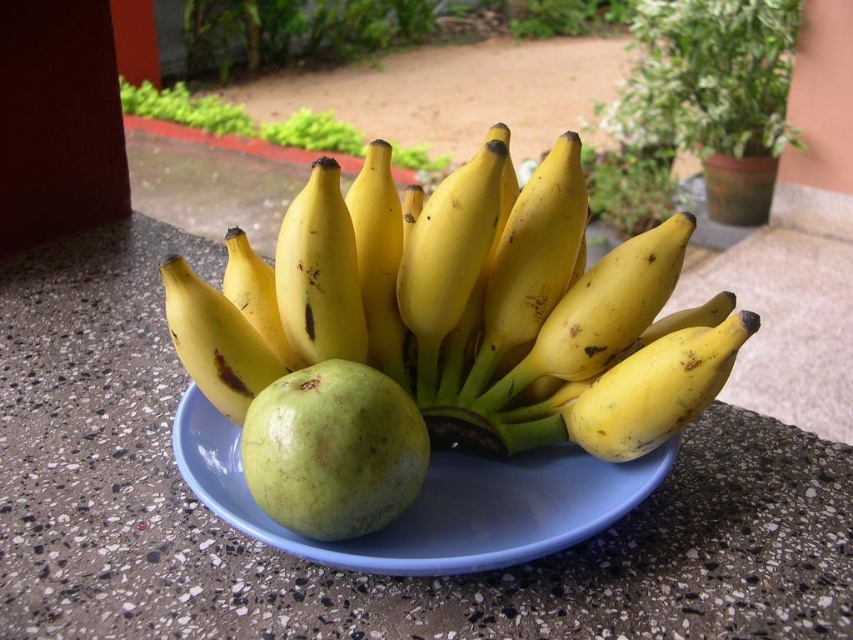
You are preparing to pack a lunch and need to choose between the yellow matte bananas at center and the green matte apple at center. If you want the bigger fruit, which one should you pick?

The yellow matte bananas at center has a larger size compared to the green matte apple at center, so you should pick the yellow matte bananas at center.

You are a fruit seller arranging fruits on a plate. You have a yellow matte bananas at center and a green matte apple at center. Which fruit takes up more horizontal space on the plate?

The yellow matte bananas at center takes up more horizontal space than the green matte apple at center because its width surpasses the apple.

You are standing in a garden and looking at the plate with bananas and an apple on the speckled countertop. There are two points marked on the countertop. Which point is closer to you, point (223, 516) or point (297, 464)?

Point (223, 516) is closer to you because it is further to the viewer than point (297, 464).